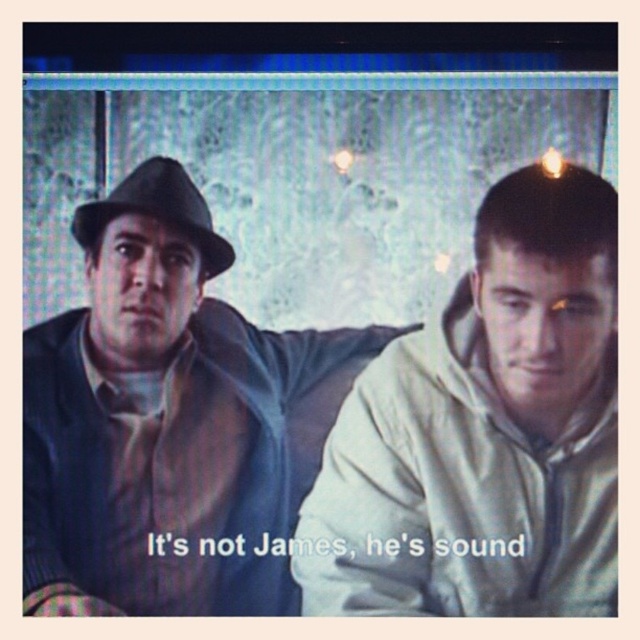
Question: In this image, where is matte brown leather jacket at left located relative to matte black fedora at left?

Choices:
 (A) above
 (B) below

Answer: (B)

Question: Which point is farther to the camera?

Choices:
 (A) (444, 337)
 (B) (205, 257)
 (C) (115, 609)

Answer: (A)

Question: Which point appears farthest from the camera in this image?

Choices:
 (A) (426, 365)
 (B) (163, 353)

Answer: (A)

Question: Is matte brown leather jacket at left positioned behind white matte hoodie at right?

Choices:
 (A) no
 (B) yes

Answer: (A)

Question: Among these objects, which one is nearest to the camera?

Choices:
 (A) matte brown leather jacket at left
 (B) matte black fedora at left
 (C) white matte hoodie at right

Answer: (A)

Question: Can you confirm if matte brown leather jacket at left is positioned above matte black fedora at left?

Choices:
 (A) yes
 (B) no

Answer: (B)